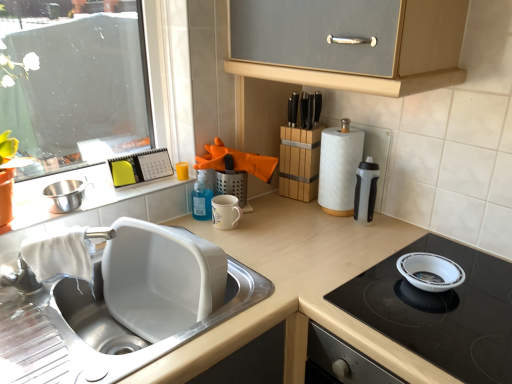
Where is `free spot to the right of translucent plastic water bottle at right`? This screenshot has height=384, width=512. free spot to the right of translucent plastic water bottle at right is located at coordinates (395, 228).